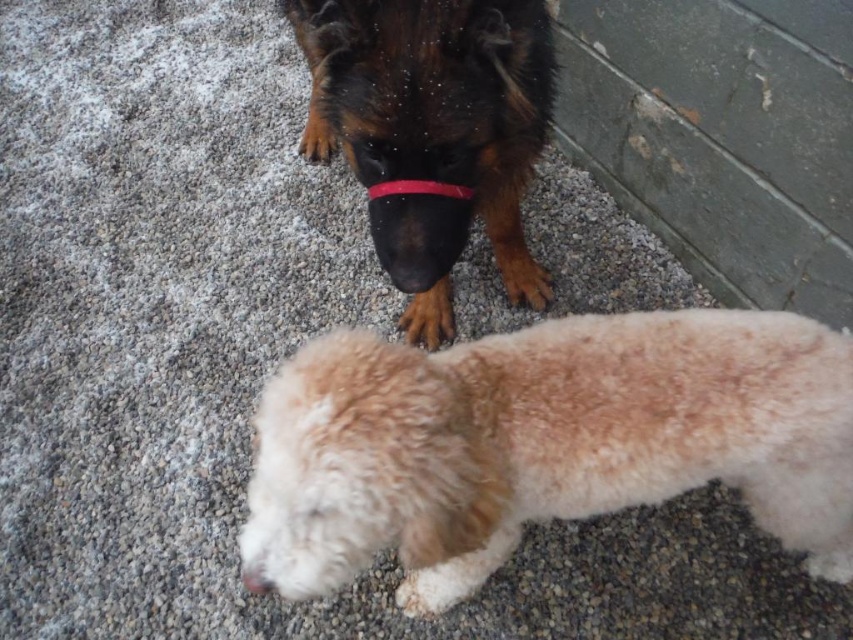
Does brown furry dog at upper center have a smaller size compared to rubber-like red collar at center?

No, brown furry dog at upper center is not smaller than rubber-like red collar at center.

Measure the distance between point (368, 205) and camera.

Point (368, 205) is 5.57 feet from camera.

Where is `brown furry dog at upper center`? This screenshot has height=640, width=853. brown furry dog at upper center is located at coordinates (433, 131).

Which is behind, point (434, 192) or point (245, 568)?

Positioned behind is point (434, 192).

Where is `rubber-like red collar at center`? The image size is (853, 640). rubber-like red collar at center is located at coordinates (418, 188).

Identify the location of rubber-like red collar at center. This screenshot has width=853, height=640. (418, 188).

Which is more to the right, white fluffy dog at lower center or brown furry dog at upper center?

Positioned to the right is white fluffy dog at lower center.

Who is more forward, [595,328] or [463,88]?

Point [595,328]

Where is `white fluffy dog at lower center`? white fluffy dog at lower center is located at coordinates (543, 442).